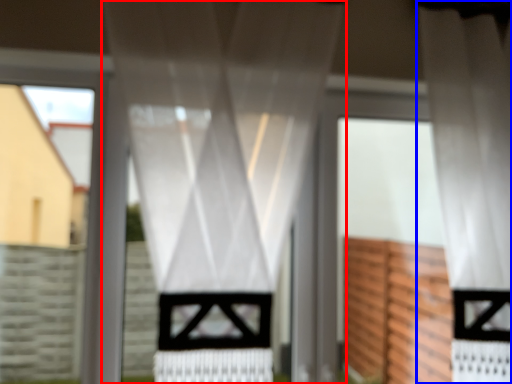
Question: Which point is further to the camera, curtain (highlighted by a red box) or curtain (highlighted by a blue box)?

Choices:
 (A) curtain
 (B) curtain

Answer: (B)